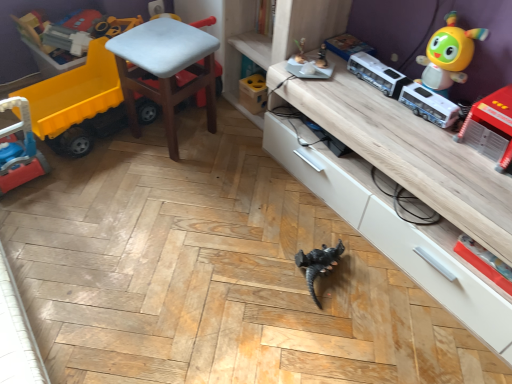
Image resolution: width=512 pixels, height=384 pixels. What are the coordinates of `vacant area that lies between white plastic chair at center and rubber yellow truck at left, the first toy viewed from the left` in the screenshot? It's located at [118, 160].